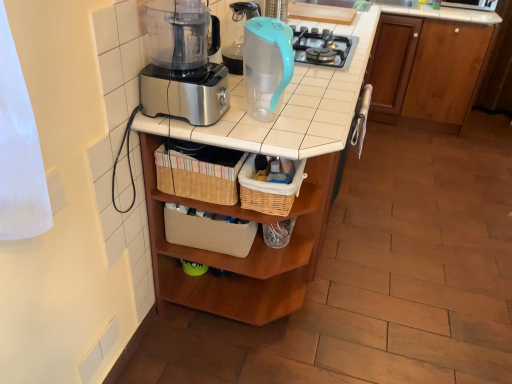
Question: Does teal plastic pitcher at upper center have a larger size compared to wooden table at center?

Choices:
 (A) yes
 (B) no

Answer: (B)

Question: Can you confirm if teal plastic pitcher at upper center is wider than wooden table at center?

Choices:
 (A) yes
 (B) no

Answer: (B)

Question: Does teal plastic pitcher at upper center have a lesser width compared to wooden table at center?

Choices:
 (A) yes
 (B) no

Answer: (A)

Question: Does teal plastic pitcher at upper center have a greater height compared to wooden table at center?

Choices:
 (A) no
 (B) yes

Answer: (A)

Question: Considering the relative positions of teal plastic pitcher at upper center and wooden table at center in the image provided, is teal plastic pitcher at upper center to the left of wooden table at center from the viewer's perspective?

Choices:
 (A) no
 (B) yes

Answer: (B)

Question: From a real-world perspective, is woven wicker basket at center, arranged as the first basket when viewed from the right, above or below brown wood cabinet at upper right?

Choices:
 (A) below
 (B) above

Answer: (B)

Question: Looking at the image, does woven wicker basket at center, which appears as the second basket when viewed from the left, seem bigger or smaller compared to brown wood cabinet at upper right?

Choices:
 (A) big
 (B) small

Answer: (B)

Question: Would you say woven wicker basket at center, arranged as the first basket when viewed from the right, is to the left or to the right of brown wood cabinet at upper right in the picture?

Choices:
 (A) right
 (B) left

Answer: (B)

Question: Relative to brown wood cabinet at upper right, is woven wicker basket at center, arranged as the first basket when viewed from the right, in front or behind?

Choices:
 (A) front
 (B) behind

Answer: (A)

Question: Is point (285, 41) positioned closer to the camera than point (239, 145)?

Choices:
 (A) farther
 (B) closer

Answer: (B)

Question: From the image's perspective, is teal plastic pitcher at upper center located above or below wooden table at center?

Choices:
 (A) below
 (B) above

Answer: (A)

Question: Is teal plastic pitcher at upper center in front of or behind wooden table at center in the image?

Choices:
 (A) behind
 (B) front

Answer: (B)

Question: From their relative heights in the image, would you say teal plastic pitcher at upper center is taller or shorter than wooden table at center?

Choices:
 (A) short
 (B) tall

Answer: (A)

Question: Is woven wicker basket at center, arranged as the first basket when viewed from the right, inside the boundaries of wooden table at center, or outside?

Choices:
 (A) inside
 (B) outside

Answer: (A)

Question: From the image's perspective, is woven wicker basket at center, which appears as the second basket when viewed from the left, above or below wooden table at center?

Choices:
 (A) above
 (B) below

Answer: (B)